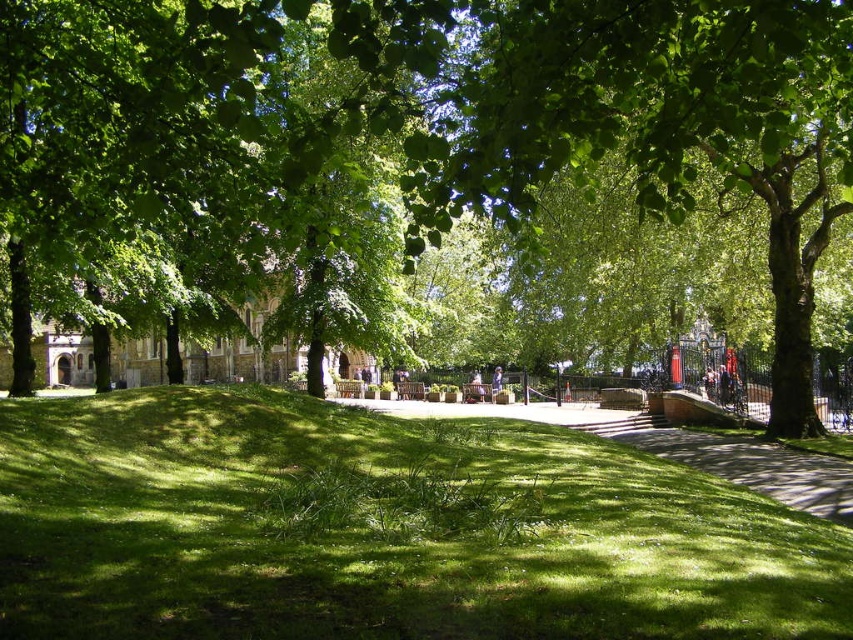
Question: Can you confirm if green grassy hill at center is smaller than green grass at center?

Choices:
 (A) no
 (B) yes

Answer: (B)

Question: Which object is the farthest from the green grassy hill at center?

Choices:
 (A) green leafy tree at center
 (B) green grass at center

Answer: (A)

Question: Which of the following is the closest to the observer?

Choices:
 (A) green leafy tree at center
 (B) green grassy hill at center
 (C) green grass at center

Answer: (B)

Question: Where is green leafy tree at center located in relation to green grassy hill at center in the image?

Choices:
 (A) below
 (B) above

Answer: (B)

Question: Among these objects, which one is nearest to the camera?

Choices:
 (A) green grass at center
 (B) green leafy tree at center

Answer: (B)

Question: Can you confirm if green grassy hill at center is smaller than green grass at center?

Choices:
 (A) yes
 (B) no

Answer: (A)